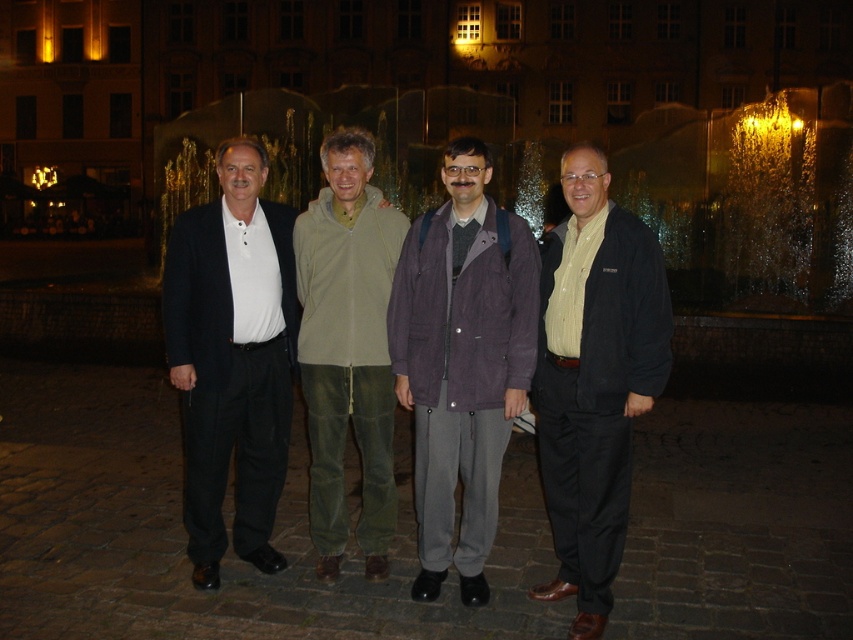
Question: Which point is closer to the camera taking this photo?

Choices:
 (A) pyautogui.click(x=378, y=440)
 (B) pyautogui.click(x=576, y=460)
 (C) pyautogui.click(x=190, y=214)

Answer: (B)

Question: Estimate the real-world distances between objects in this image. Which object is farther from the purple fabric jacket at center?

Choices:
 (A) matte black suit at left
 (B) olive-green corduroy pants at center
 (C) matte black jacket at right

Answer: (A)

Question: Can you confirm if purple fabric jacket at center is smaller than matte black jacket at right?

Choices:
 (A) yes
 (B) no

Answer: (A)

Question: Can you confirm if matte black suit at left is bigger than olive-green corduroy pants at center?

Choices:
 (A) yes
 (B) no

Answer: (A)

Question: Is purple fabric jacket at center to the left of matte black jacket at right from the viewer's perspective?

Choices:
 (A) yes
 (B) no

Answer: (A)

Question: Which point appears farthest from the camera in this image?

Choices:
 (A) (596, 552)
 (B) (480, 180)
 (C) (341, 264)
 (D) (204, 472)

Answer: (C)